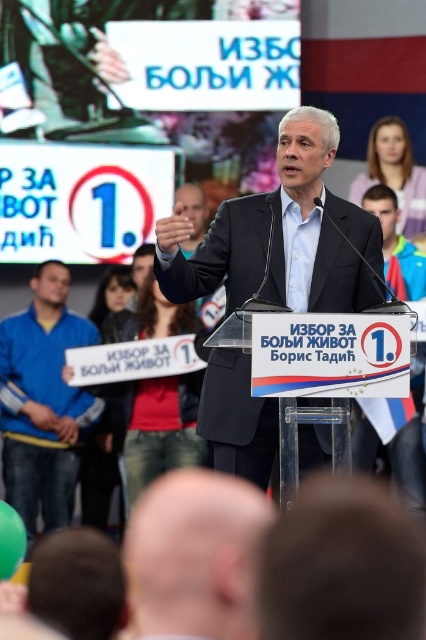
Can you confirm if blue fabric sign at left is positioned to the right of blue fabric jacket at upper right?

Incorrect, blue fabric sign at left is not on the right side of blue fabric jacket at upper right.

The image size is (426, 640). In order to click on blue fabric sign at left in this screenshot , I will do `click(43, 401)`.

Is point (58, 384) positioned before point (391, 228)?

Yes, it is in front of point (391, 228).

Where is `blue fabric sign at left`? The width and height of the screenshot is (426, 640). blue fabric sign at left is located at coordinates (43, 401).

Is the position of matte black suit at center less distant than that of smooth bald head at lower center?

No, it is behind smooth bald head at lower center.

This screenshot has width=426, height=640. What do you see at coordinates (282, 236) in the screenshot? I see `matte black suit at center` at bounding box center [282, 236].

Is point (360, 301) positioned behind point (158, 579)?

Yes, it is.

The width and height of the screenshot is (426, 640). I want to click on matte black suit at center, so click(282, 236).

Who is shorter, denim jeans at center or pink fabric at upper right?

pink fabric at upper right is shorter.

Does denim jeans at center have a smaller size compared to pink fabric at upper right?

Incorrect, denim jeans at center is not smaller in size than pink fabric at upper right.

What do you see at coordinates (158, 426) in the screenshot? The height and width of the screenshot is (640, 426). I see `denim jeans at center` at bounding box center [158, 426].

Where is `denim jeans at center`? The image size is (426, 640). denim jeans at center is located at coordinates (158, 426).